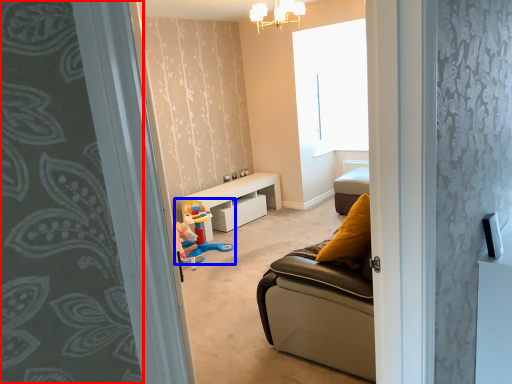
Question: Which object is further to the camera taking this photo, curtain (highlighted by a red box) or toy (highlighted by a blue box)?

Choices:
 (A) curtain
 (B) toy

Answer: (B)